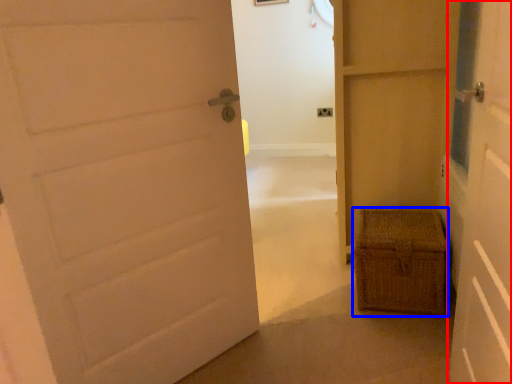
Question: Which of the following is the closest to the observer, door (highlighted by a red box) or crate (highlighted by a blue box)?

Choices:
 (A) door
 (B) crate

Answer: (A)